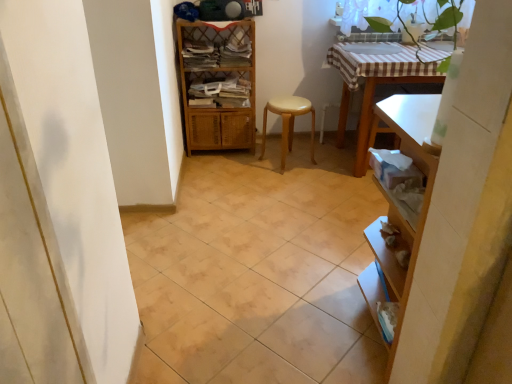
Question: Is woven wood shelf at center aimed at white glossy sink at upper center?

Choices:
 (A) no
 (B) yes

Answer: (A)

Question: Considering the relative sizes of woven wood shelf at center and white glossy sink at upper center in the image provided, is woven wood shelf at center thinner than white glossy sink at upper center?

Choices:
 (A) yes
 (B) no

Answer: (A)

Question: Does woven wood shelf at center come in front of white glossy sink at upper center?

Choices:
 (A) yes
 (B) no

Answer: (B)

Question: Considering the relative sizes of woven wood shelf at center and white glossy sink at upper center in the image provided, is woven wood shelf at center wider than white glossy sink at upper center?

Choices:
 (A) yes
 (B) no

Answer: (B)

Question: Is woven wood shelf at center looking in the opposite direction of white glossy sink at upper center?

Choices:
 (A) no
 (B) yes

Answer: (A)

Question: Considering the relative sizes of woven wood shelf at center and white glossy sink at upper center in the image provided, is woven wood shelf at center smaller than white glossy sink at upper center?

Choices:
 (A) yes
 (B) no

Answer: (B)

Question: Is white glossy sink at upper center placed right next to woven wood shelf at center?

Choices:
 (A) no
 (B) yes

Answer: (A)

Question: Is white glossy sink at upper center located outside woven wood shelf at center?

Choices:
 (A) yes
 (B) no

Answer: (A)

Question: From the image's perspective, does white glossy sink at upper center appear lower than woven wood shelf at center?

Choices:
 (A) no
 (B) yes

Answer: (A)

Question: Can you confirm if white glossy sink at upper center is thinner than woven wood shelf at center?

Choices:
 (A) yes
 (B) no

Answer: (B)

Question: Considering the relative positions of white glossy sink at upper center and woven wood shelf at center in the image provided, is white glossy sink at upper center to the left of woven wood shelf at center from the viewer's perspective?

Choices:
 (A) yes
 (B) no

Answer: (B)

Question: Can you confirm if white glossy sink at upper center is positioned to the right of woven wood shelf at center?

Choices:
 (A) yes
 (B) no

Answer: (A)

Question: Does beige ceramic tile at center have a larger size compared to woven wood shelf at center?

Choices:
 (A) no
 (B) yes

Answer: (A)